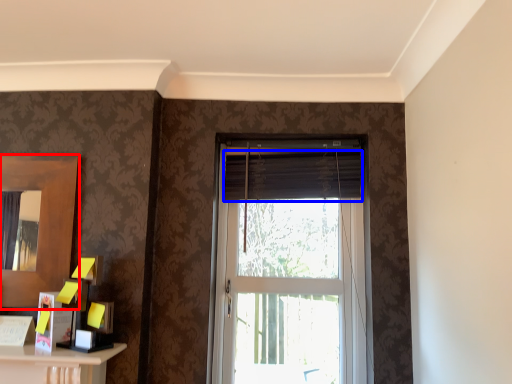
Question: Which object appears closest to the camera in this image, mirror (highlighted by a red box) or curtain (highlighted by a blue box)?

Choices:
 (A) mirror
 (B) curtain

Answer: (A)